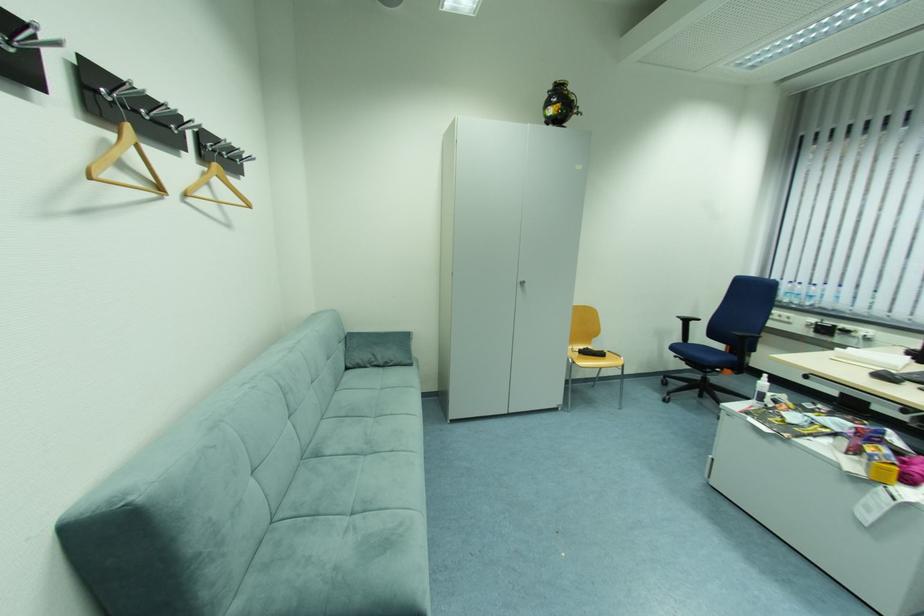
What do you see at coordinates (360, 503) in the screenshot?
I see `the sofa sitting surface` at bounding box center [360, 503].